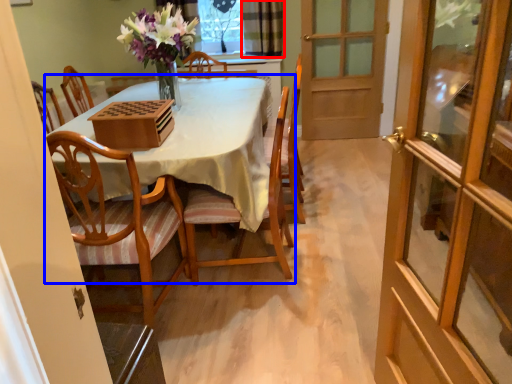
Question: Which of the following is the farthest to the observer, curtain (highlighted by a red box) or kitchen & dining room table (highlighted by a blue box)?

Choices:
 (A) curtain
 (B) kitchen & dining room table

Answer: (A)